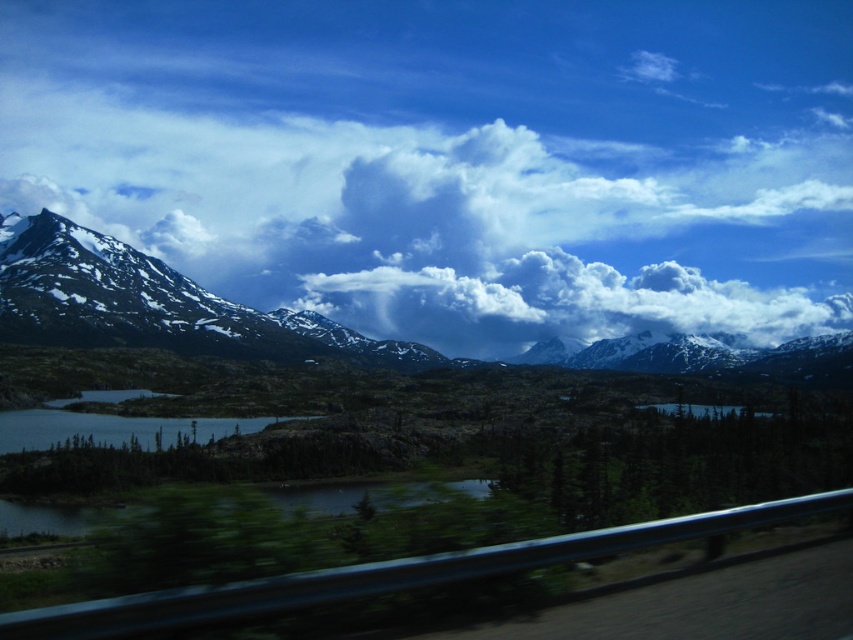
You are standing at the roadside and looking at the white fluffy cloud at upper center. If you want to point to the exact location of the cloud in the image, what coordinates would you use?

The exact coordinates of the white fluffy cloud at upper center are at point (450, 218).

You are a photographer planning to capture the snowy rock mountain range at upper left and the white fluffy cloud at upper center in a single frame. Which object should you adjust your camera focus on first to ensure both are in the frame?

The white fluffy cloud at upper center is positioned on the left side of snowy rock mountain range at upper left, so you should focus on the snowy rock mountain range at upper left first to ensure both are in the frame.

You are a photographer standing at the roadside guardrail. You want to capture a photo of the white fluffy cloud at center. Where should you aim your camera?

You should aim your camera at point 0.475 on the horizontal axis and 0.655 on the vertical axis to capture the white fluffy cloud at center.